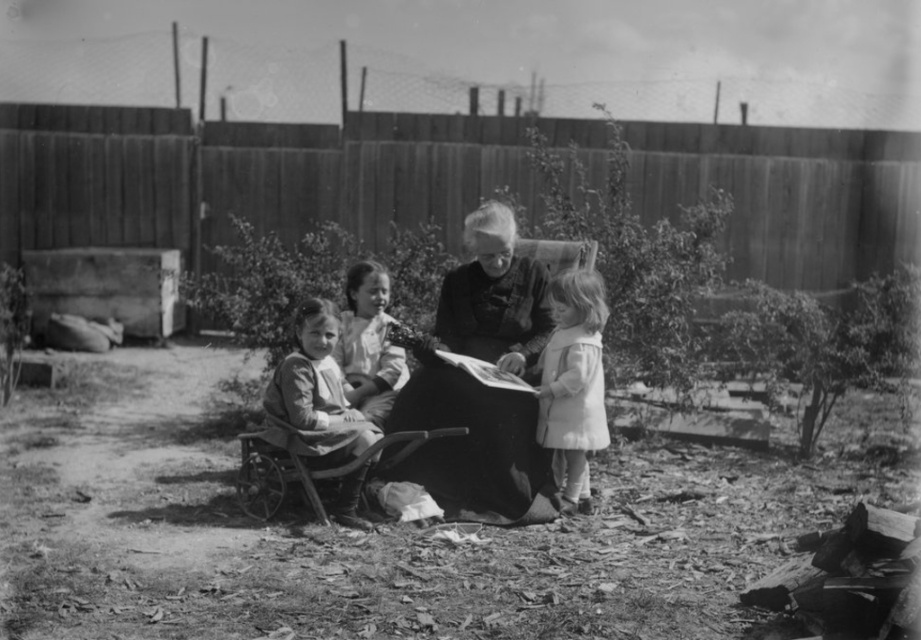
Is matte black dress at center wider than white cotton dress at center?

Indeed, matte black dress at center has a greater width compared to white cotton dress at center.

Does matte black dress at center come in front of white cotton dress at center?

Yes, it is in front of white cotton dress at center.

The height and width of the screenshot is (640, 921). Identify the location of matte black dress at center. (482, 384).

Image resolution: width=921 pixels, height=640 pixels. Identify the location of matte black dress at center. point(482,384).

Does smooth black dress at center appear on the left side of fuzzy white coat at lower right?

Correct, you'll find smooth black dress at center to the left of fuzzy white coat at lower right.

Can you confirm if smooth black dress at center is shorter than fuzzy white coat at lower right?

No, smooth black dress at center is not shorter than fuzzy white coat at lower right.

Which is in front, point (416, 401) or point (578, 368)?

Point (578, 368) is in front.

Find the location of a particular element. smooth black dress at center is located at coordinates (479, 384).

Can you confirm if matte black dress at center is positioned below smooth black dress at center?

Yes, matte black dress at center is below smooth black dress at center.

Between matte black dress at center and smooth black dress at center, which one is positioned lower?

matte black dress at center

This screenshot has width=921, height=640. What do you see at coordinates (482, 384) in the screenshot?
I see `matte black dress at center` at bounding box center [482, 384].

Where is `matte black dress at center`? Image resolution: width=921 pixels, height=640 pixels. matte black dress at center is located at coordinates (482, 384).